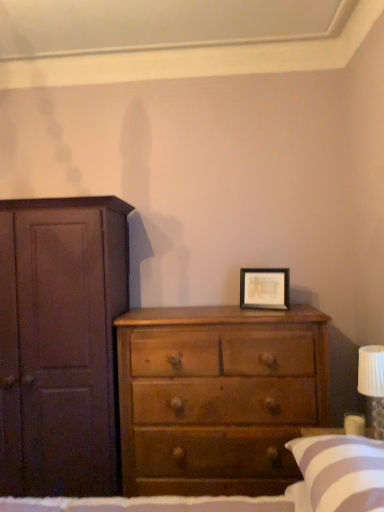
Question: From the image's perspective, would you say wooden framed artwork at center right is positioned over white striped pillow at lower right?

Choices:
 (A) yes
 (B) no

Answer: (A)

Question: Can we say wooden framed artwork at center right lies outside white striped pillow at lower right?

Choices:
 (A) yes
 (B) no

Answer: (A)

Question: Is white striped pillow at lower right completely or partially inside wooden framed artwork at center right?

Choices:
 (A) no
 (B) yes

Answer: (A)

Question: Considering the relative sizes of wooden framed artwork at center right and white striped pillow at lower right in the image provided, is wooden framed artwork at center right smaller than white striped pillow at lower right?

Choices:
 (A) no
 (B) yes

Answer: (B)

Question: Can you confirm if wooden framed artwork at center right is shorter than white striped pillow at lower right?

Choices:
 (A) yes
 (B) no

Answer: (B)

Question: Is white striped pillow at lower right in front of or behind wooden framed artwork at center right in the image?

Choices:
 (A) behind
 (B) front

Answer: (B)

Question: Considering the positions of white striped pillow at lower right and wooden framed artwork at center right in the image, is white striped pillow at lower right bigger or smaller than wooden framed artwork at center right?

Choices:
 (A) big
 (B) small

Answer: (A)

Question: From the image's perspective, is white striped pillow at lower right located above or below wooden framed artwork at center right?

Choices:
 (A) below
 (B) above

Answer: (A)

Question: Considering the positions of white striped pillow at lower right and wooden framed artwork at center right in the image, is white striped pillow at lower right taller or shorter than wooden framed artwork at center right?

Choices:
 (A) short
 (B) tall

Answer: (A)

Question: From a real-world perspective, relative to wooden framed artwork at center right, is light brown wood chest of drawers at center vertically above or below?

Choices:
 (A) below
 (B) above

Answer: (A)

Question: Is light brown wood chest of drawers at center in front of or behind wooden framed artwork at center right in the image?

Choices:
 (A) behind
 (B) front

Answer: (B)

Question: From the image's perspective, is light brown wood chest of drawers at center above or below wooden framed artwork at center right?

Choices:
 (A) below
 (B) above

Answer: (A)

Question: In terms of height, does light brown wood chest of drawers at center look taller or shorter compared to wooden framed artwork at center right?

Choices:
 (A) tall
 (B) short

Answer: (A)

Question: Considering their positions, is light brown wood chest of drawers at center located in front of or behind white striped pillow at lower right?

Choices:
 (A) behind
 (B) front

Answer: (A)

Question: Would you say light brown wood chest of drawers at center is to the left or to the right of white striped pillow at lower right in the picture?

Choices:
 (A) left
 (B) right

Answer: (A)